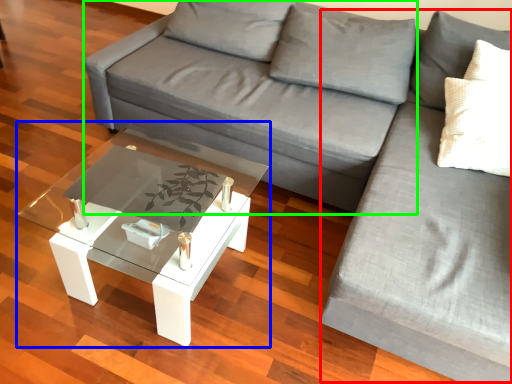
Question: Which object is the closest to the couch (highlighted by a red box)? Choose among these: coffee table (highlighted by a blue box) or couch (highlighted by a green box).

Choices:
 (A) coffee table
 (B) couch

Answer: (B)